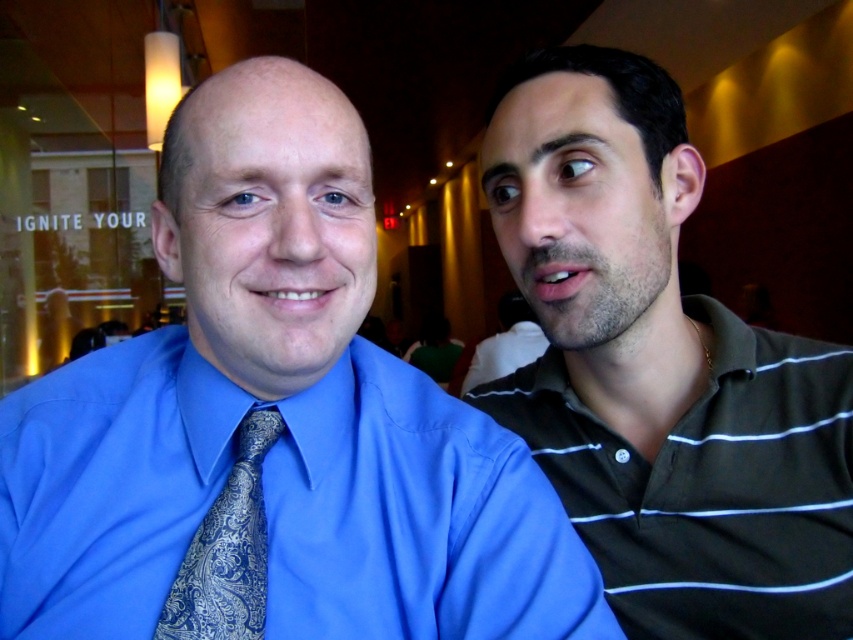
You are standing in front of the image and want to locate the green striped polo shirt at right. What are its coordinates on the image?

The green striped polo shirt at right is located at coordinates point [660,369].

You are a photographer setting up for a portrait shoot. You have two subjects wearing the blue satin shirt at center and the striped jersey shirt at right. The camera is placed at eye level. Which subject will appear closer to the camera in the photo?

The blue satin shirt at center will appear closer to the camera because it is positioned under the striped jersey shirt at right, meaning it is lower in the frame and thus closer to the camera lens.

You are a photographer setting up a photo shoot. You have two shirts to display in the frame. The blue satin shirt at center and the striped jersey shirt at right. Which shirt should you choose to ensure it appears larger in the final photograph?

The striped jersey shirt at right is larger than the blue satin shirt at center, so choosing it will make it appear larger in the photograph.